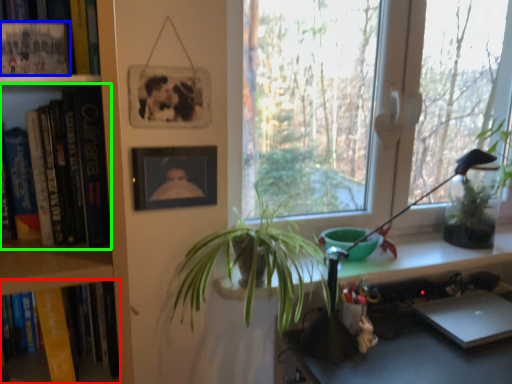
Question: Based on their relative distances, which object is farther from book (highlighted by a red box)? Choose from book (highlighted by a blue box) and book (highlighted by a green box).

Choices:
 (A) book
 (B) book

Answer: (A)